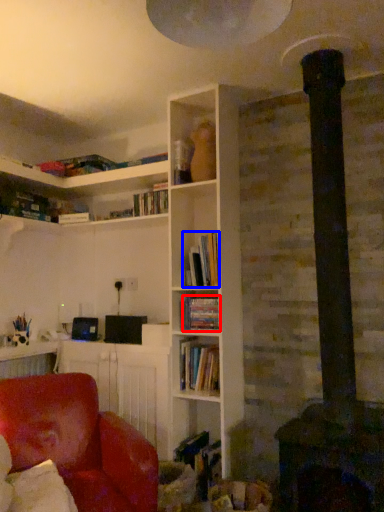
Question: Which object appears farthest to the camera in this image, book (highlighted by a red box) or book (highlighted by a blue box)?

Choices:
 (A) book
 (B) book

Answer: (A)